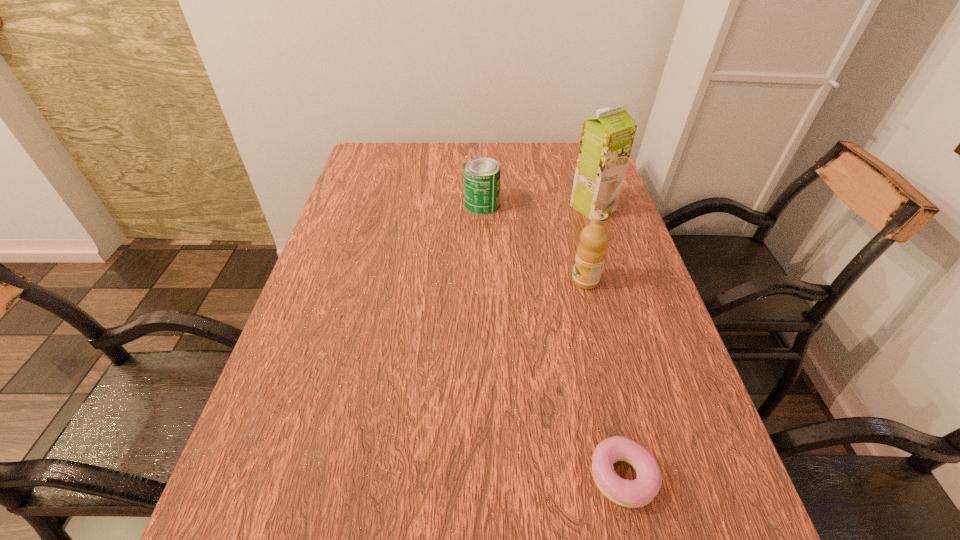
Where is `vacant position located on the label of the olive oil`? The image size is (960, 540). vacant position located on the label of the olive oil is located at coordinates (469, 281).

Locate an element on the screen. Image resolution: width=960 pixels, height=540 pixels. free space located on the front of the leftmost object is located at coordinates (482, 230).

You are a GUI agent. You are given a task and a screenshot of the screen. Output one action in this format:
    pyautogui.click(x=<x>, y=<y>)
    Task: Click on the free space located on the back of the doughnut
    This screenshot has width=960, height=540.
    Given the screenshot: What is the action you would take?
    pyautogui.click(x=603, y=390)

Where is `soya milk that is at the right edge`? The width and height of the screenshot is (960, 540). soya milk that is at the right edge is located at coordinates (606, 141).

You are a GUI agent. You are given a task and a screenshot of the screen. Output one action in this format:
    pyautogui.click(x=<x>, y=<y>)
    Task: Click on the olive oil present at the right edge
    
    Given the screenshot: What is the action you would take?
    pyautogui.click(x=591, y=252)

Where is `doughnut located at the right edge`? This screenshot has height=540, width=960. doughnut located at the right edge is located at coordinates (636, 493).

I want to click on free space at the far edge of the desktop, so click(x=447, y=153).

Identify the location of vacant point at the left edge. The image size is (960, 540). (368, 273).

Locate an element on the screen. This screenshot has width=960, height=540. blank area at the right edge is located at coordinates (636, 253).

You are a GUI agent. You are given a task and a screenshot of the screen. Output one action in this format:
    pyautogui.click(x=<x>, y=<y>)
    Task: Click on the vacant space at the far left corner of the desktop
    The height and width of the screenshot is (540, 960).
    Given the screenshot: What is the action you would take?
    pyautogui.click(x=368, y=145)